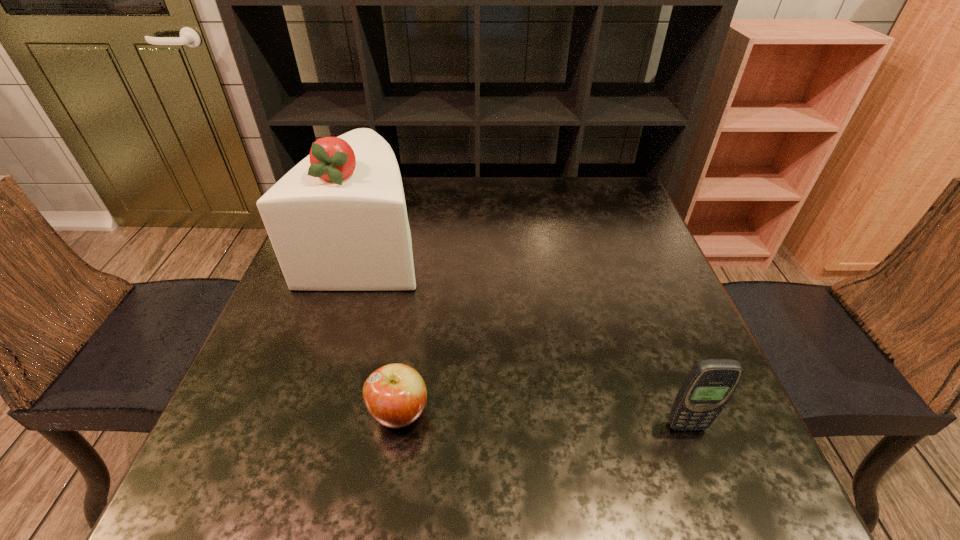
The height and width of the screenshot is (540, 960). Find the location of `object at the right edge`. object at the right edge is located at coordinates coord(710,384).

Where is `object present at the far left corner`? The height and width of the screenshot is (540, 960). object present at the far left corner is located at coordinates (337, 221).

The image size is (960, 540). I want to click on vacant space at the far edge of the desktop, so click(457, 213).

Where is `vacant space at the near edge of the desktop`? The image size is (960, 540). vacant space at the near edge of the desktop is located at coordinates (412, 461).

In order to click on free space at the left edge of the desktop in this screenshot , I will do `click(286, 426)`.

Locate an element on the screen. The image size is (960, 540). free space at the right edge is located at coordinates (613, 270).

The height and width of the screenshot is (540, 960). In the image, there is a desktop. What are the coordinates of `vacant space at the far right corner` in the screenshot? It's located at (588, 185).

Locate an element on the screen. Image resolution: width=960 pixels, height=540 pixels. vacant space in between the cellular telephone and the apple is located at coordinates (542, 419).

This screenshot has height=540, width=960. I want to click on vacant point located between the shortest object and the tallest object, so click(x=383, y=329).

You are a GUI agent. You are given a task and a screenshot of the screen. Output one action in this format:
    pyautogui.click(x=<x>, y=<y>)
    Task: Click on the free space between the cake and the shortest object
    
    Given the screenshot: What is the action you would take?
    pyautogui.click(x=383, y=329)